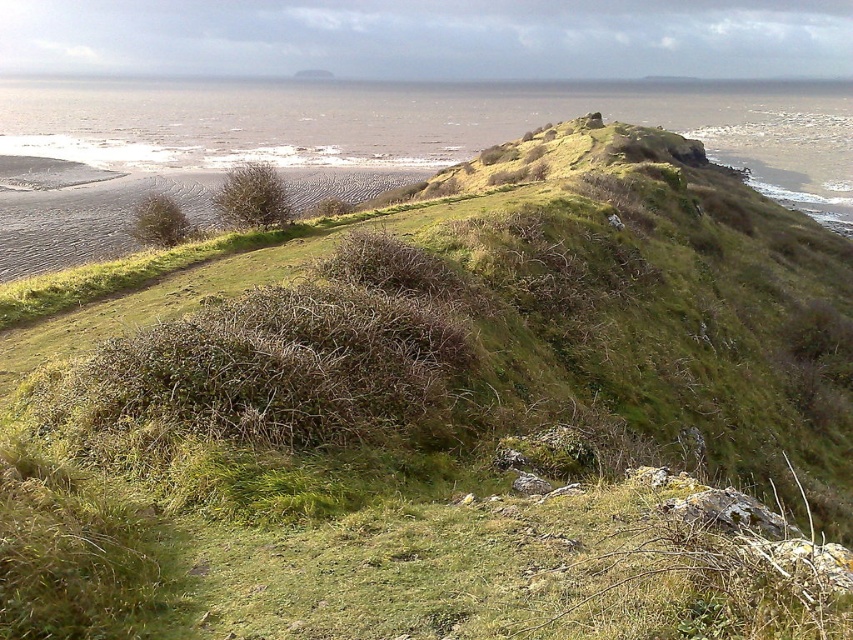
Identify the location of green leafy bush at center. (251, 198).

Between point (267, 173) and point (173, 220), which one is positioned in front?

Point (267, 173)

Is point (287, 202) positioned in front of point (177, 220)?

No, (287, 202) is further to viewer.

Locate an element on the screen. This screenshot has width=853, height=640. green leafy bush at center is located at coordinates (251, 198).